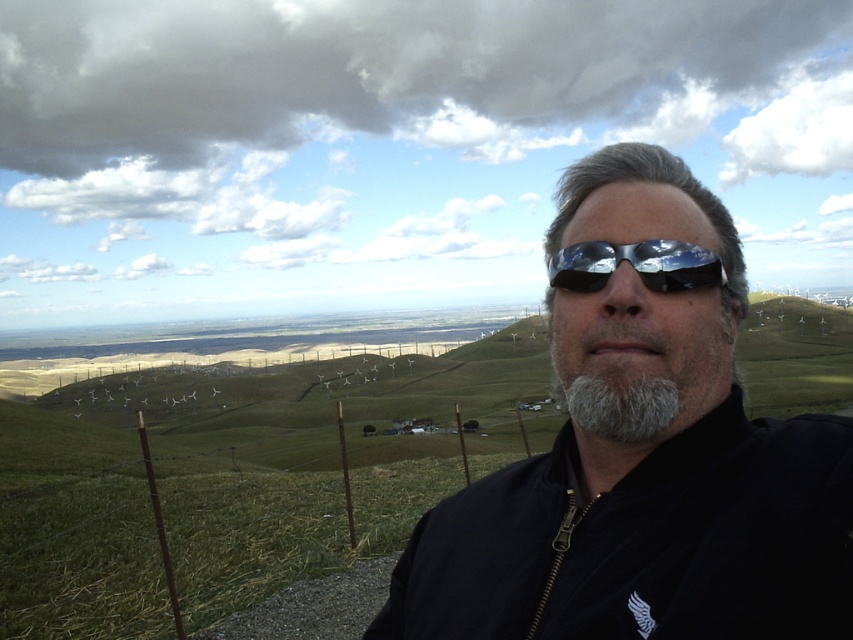
Question: Which object is positioned farthest from the graysoftbeard at center?

Choices:
 (A) glossy plastic sunglasses at center
 (B) shiny black sunglasses at center

Answer: (B)

Question: Is shiny black sunglasses at center positioned in front of glossy plastic sunglasses at center?

Choices:
 (A) no
 (B) yes

Answer: (B)

Question: Is shiny black sunglasses at center closer to the viewer compared to gray matte beard at center?

Choices:
 (A) yes
 (B) no

Answer: (A)

Question: Can you confirm if glossy plastic sunglasses at center is positioned above gray matte beard at center?

Choices:
 (A) yes
 (B) no

Answer: (A)

Question: Which of the following is the farthest from the observer?

Choices:
 (A) glossy plastic sunglasses at center
 (B) shiny black sunglasses at center
 (C) gray matte beard at center

Answer: (A)

Question: Among these points, which one is nearest to the camera?

Choices:
 (A) (647, 426)
 (B) (613, 253)
 (C) (555, 326)

Answer: (A)